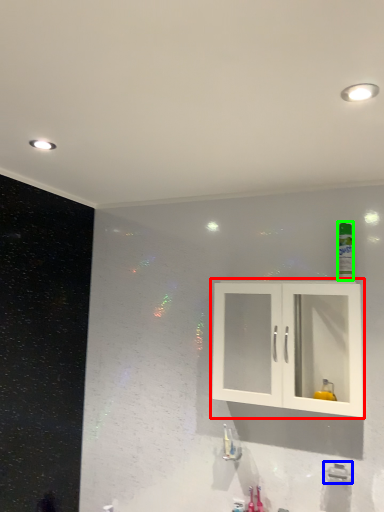
Question: Which is nearer to the cabinetry (highlighted by a red box)? plumbing fixture (highlighted by a blue box) or mouthwash (highlighted by a green box).

Choices:
 (A) plumbing fixture
 (B) mouthwash

Answer: (B)